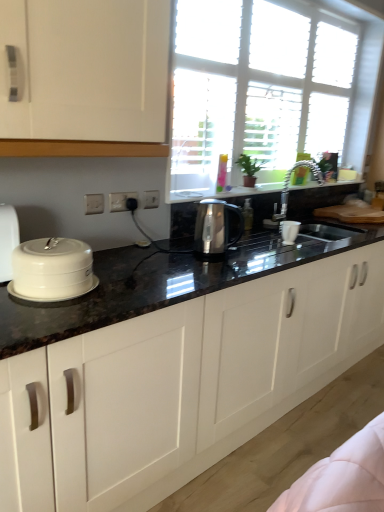
Question: Considering their positions, is transparent glass window at upper center located in front of or behind white glossy cabinets at center?

Choices:
 (A) front
 (B) behind

Answer: (B)

Question: Considering the positions of transparent glass window at upper center and white glossy cabinets at center in the image, is transparent glass window at upper center taller or shorter than white glossy cabinets at center?

Choices:
 (A) short
 (B) tall

Answer: (B)

Question: Based on their relative distances, which object is farther from the white glossy cabinets at center?

Choices:
 (A) white plastic electric outlet at center, positioned as the 1th electric outlet in right-to-left order
 (B) white plastic electric outlet at center, which ranks as the 2th electric outlet in front-to-back order
 (C) metallic shiny faucet at upper center
 (D) satin metallic kettle at center
 (E) white plastic electric outlet at center, the 3th electric outlet viewed from the back

Answer: (C)

Question: Considering the real-world distances, which object is closest to the satin metallic kettle at center?

Choices:
 (A) white plastic electric outlet at center, which ranks as the 2th electric outlet in back-to-front order
 (B) white plastic electric outlet at center, which appears as the 3th electric outlet when viewed from the front
 (C) transparent glass window at upper center
 (D) white ceramic lid at left
 (E) metallic shiny faucet at upper center

Answer: (B)